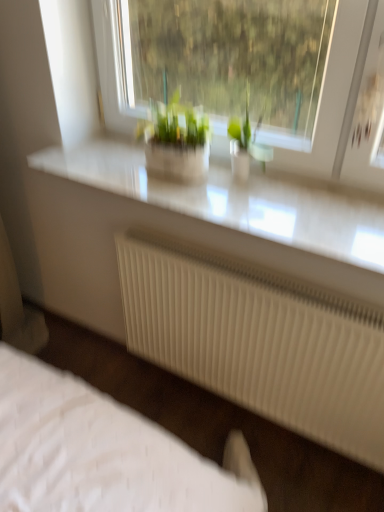
You are a GUI agent. You are given a task and a screenshot of the screen. Output one action in this format:
    pyautogui.click(x=<x>, y=<y>)
    Task: Click on the vacant space underneath white ribbed radiator at lower center (from a real-world perspective)
    This screenshot has height=512, width=384.
    Given the screenshot: What is the action you would take?
    pyautogui.click(x=245, y=414)